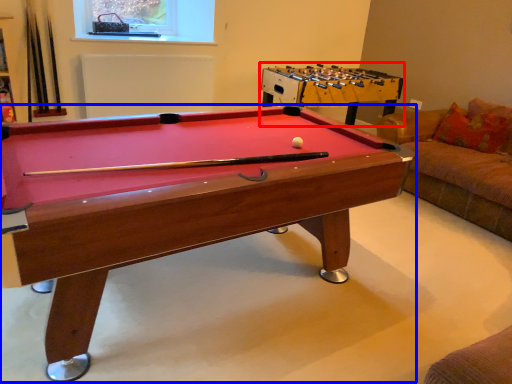
Question: Among these objects, which one is nearest to the camera, table (highlighted by a red box) or billiard table (highlighted by a blue box)?

Choices:
 (A) table
 (B) billiard table

Answer: (B)